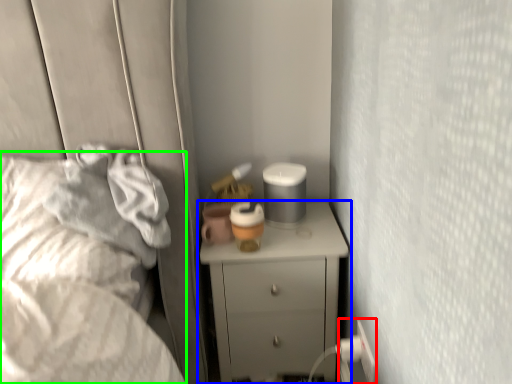
Question: Based on their relative distances, which object is farther from electric outlet (highlighted by a red box)? Choose from chest of drawers (highlighted by a blue box) and bed (highlighted by a green box).

Choices:
 (A) chest of drawers
 (B) bed

Answer: (B)